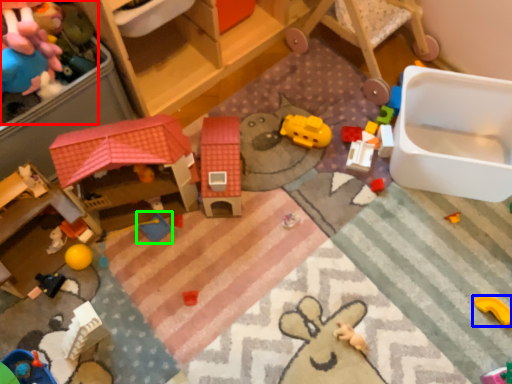
Question: Which object is the farthest from toy (highlighted by a red box)? Choose among these: toy (highlighted by a blue box) or toy (highlighted by a green box).

Choices:
 (A) toy
 (B) toy

Answer: (A)